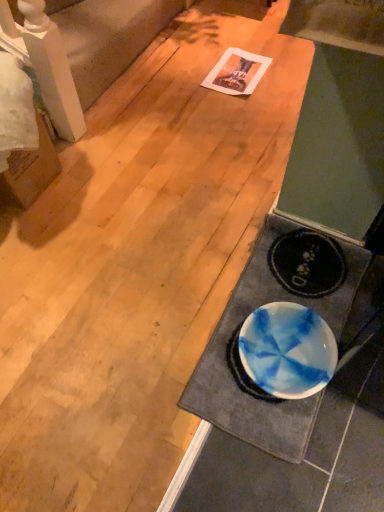
Locate an element on the screen. This screenshot has height=512, width=384. vacant space behind white glossy bowl at lower right is located at coordinates (210, 204).